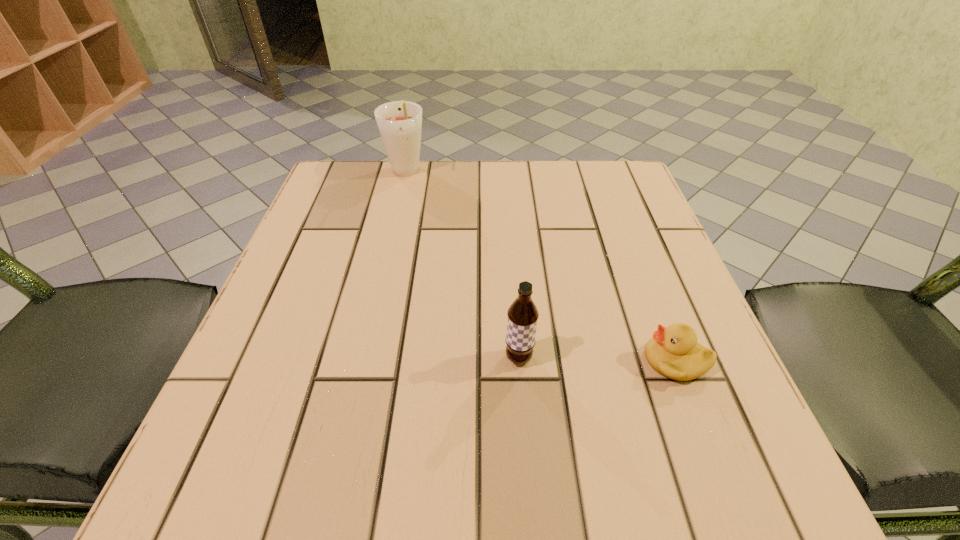
Locate an element on the screen. object that stands as the second closest to the duckling is located at coordinates (399, 122).

The height and width of the screenshot is (540, 960). In order to click on object that is the closest one to the right root beer in this screenshot , I will do `click(674, 352)`.

You are a GUI agent. You are given a task and a screenshot of the screen. Output one action in this format:
    pyautogui.click(x=<x>, y=<y>)
    Task: Click on the free location that satisfies the following two spatial constraints: 1. on the drink side of the second object from left to right; 2. on the left side of the tallest object
    The width and height of the screenshot is (960, 540).
    Given the screenshot: What is the action you would take?
    pyautogui.click(x=362, y=358)

Find the location of a particular element. The width and height of the screenshot is (960, 540). vacant position in the image that satisfies the following two spatial constraints: 1. on the drink side of the second object from right to left; 2. on the left side of the farthest object is located at coordinates (362, 358).

Locate an element on the screen. This screenshot has height=540, width=960. vacant area that satisfies the following two spatial constraints: 1. on the drink side of the shorter root beer; 2. on the right side of the tallest object is located at coordinates (362, 358).

Image resolution: width=960 pixels, height=540 pixels. I want to click on free spot that satisfies the following two spatial constraints: 1. on the drink side of the farthest object; 2. on the left side of the shorter root beer, so click(x=362, y=358).

In order to click on vacant space that satisfies the following two spatial constraints: 1. on the drink side of the left root beer; 2. on the left side of the nearer root beer in this screenshot , I will do `click(362, 358)`.

What are the coordinates of `vacant region that satisfies the following two spatial constraints: 1. on the drink side of the right root beer; 2. on the left side of the farther root beer` in the screenshot? It's located at (362, 358).